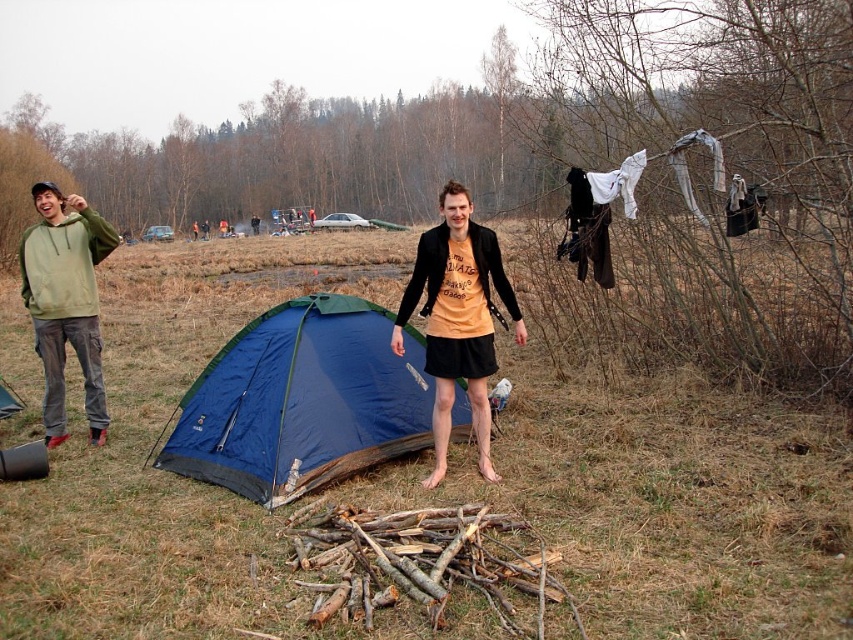
In the scene shown: You are a photographer trying to capture a clear shot of both the matte green hoodie at left and the green fleece hoodie at left. Since they are positioned close to each other, will you need to adjust your focus to include both in the frame?

The matte green hoodie at left is in front of the green fleece hoodie at left, so you will need to adjust your focus to ensure both are in the frame, as they are layered with one in front of the other.